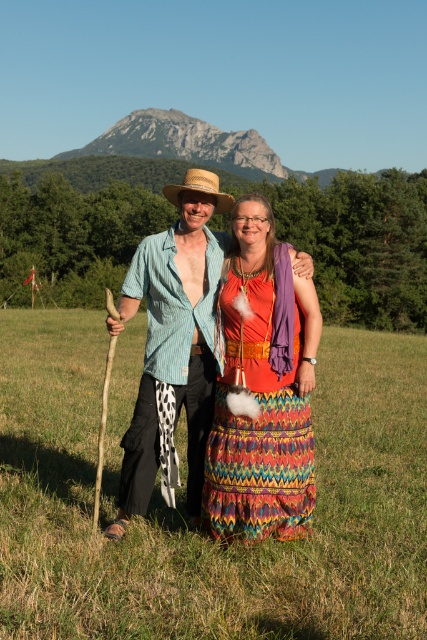
Question: Which point is farther to the camera?

Choices:
 (A) (245, 326)
 (B) (187, 186)

Answer: (B)

Question: Is multicolored woven skirt at center further to camera compared to striped cotton shirt at center?

Choices:
 (A) yes
 (B) no

Answer: (B)

Question: Is green grass at center to the right of multicolored woven skirt at center from the viewer's perspective?

Choices:
 (A) yes
 (B) no

Answer: (B)

Question: Which point appears closest to the camera in this image?

Choices:
 (A) (245, 280)
 (B) (227, 200)

Answer: (A)

Question: Which of these objects is positioned closest to the striped cotton shirt at center?

Choices:
 (A) green grass at center
 (B) gray rock formation at upper center
 (C) strawmaterial/texturecowboy hat at center

Answer: (C)

Question: Is green grass at center positioned before strawmaterial/texturecowboy hat at center?

Choices:
 (A) yes
 (B) no

Answer: (A)